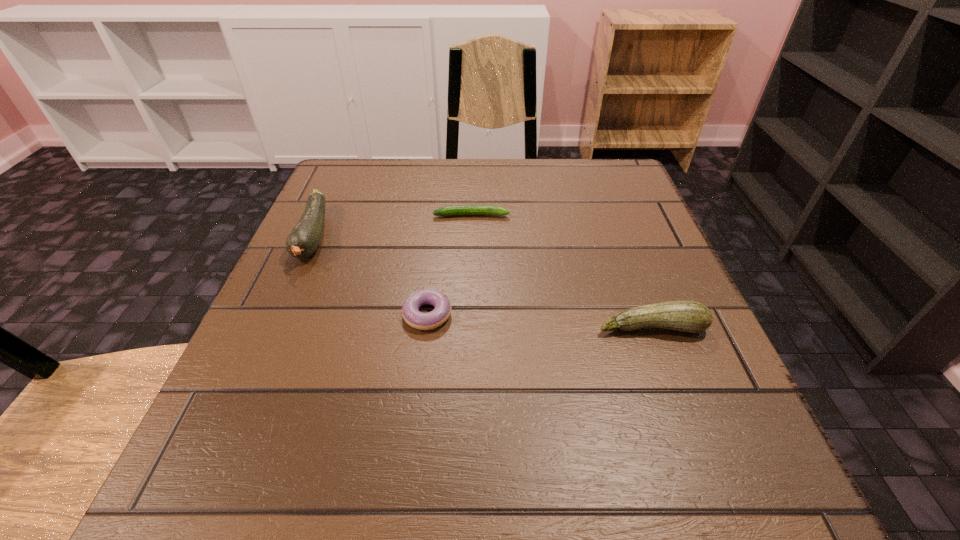
Identify the location of object situated at the left edge. coord(304,239).

In order to click on object that is at the right edge in this screenshot , I will do `click(686, 316)`.

Where is `object that is positioned at the far left corner`? The image size is (960, 540). object that is positioned at the far left corner is located at coordinates (304, 239).

In the image, there is a desktop. Where is `vacant space at the far edge`? The image size is (960, 540). vacant space at the far edge is located at coordinates (504, 166).

In the image, there is a desktop. At what (x,y) coordinates should I click in order to perform the action: click on vacant space at the near edge. Please return your answer as a coordinate pair (x, y). Looking at the image, I should click on (471, 447).

Identify the location of free spot at the left edge of the desktop. (332, 274).

Where is `free space at the right edge`? free space at the right edge is located at coordinates (634, 274).

This screenshot has height=540, width=960. In order to click on free space at the far right corner in this screenshot , I will do `click(569, 167)`.

The width and height of the screenshot is (960, 540). What are the coordinates of `free space between the doughnut and the rightmost object` in the screenshot? It's located at (540, 321).

I want to click on vacant space that is in between the shortest zucchini and the doughnut, so click(x=449, y=265).